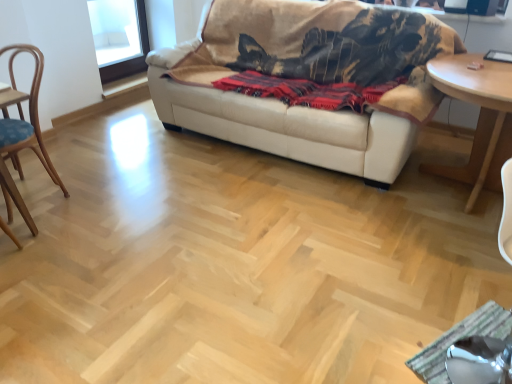
Question: Does wooden chair at left have a lesser height compared to red woven blanket at center?

Choices:
 (A) no
 (B) yes

Answer: (A)

Question: Can you confirm if wooden chair at left is taller than red woven blanket at center?

Choices:
 (A) yes
 (B) no

Answer: (A)

Question: Is red woven blanket at center inside wooden chair at left?

Choices:
 (A) yes
 (B) no

Answer: (B)

Question: Considering the relative sizes of wooden chair at left and red woven blanket at center in the image provided, is wooden chair at left wider than red woven blanket at center?

Choices:
 (A) yes
 (B) no

Answer: (A)

Question: Can you see wooden chair at left touching red woven blanket at center?

Choices:
 (A) no
 (B) yes

Answer: (A)

Question: From the image's perspective, is wooden chair at left on red woven blanket at center?

Choices:
 (A) no
 (B) yes

Answer: (A)

Question: Is beige leather couch at upper center far from metallic silver swivel chair at lower right?

Choices:
 (A) yes
 (B) no

Answer: (A)

Question: Is beige leather couch at upper center looking in the opposite direction of metallic silver swivel chair at lower right?

Choices:
 (A) yes
 (B) no

Answer: (B)

Question: From the image's perspective, is beige leather couch at upper center below metallic silver swivel chair at lower right?

Choices:
 (A) no
 (B) yes

Answer: (A)

Question: Is beige leather couch at upper center at the left side of metallic silver swivel chair at lower right?

Choices:
 (A) no
 (B) yes

Answer: (B)

Question: Can you confirm if beige leather couch at upper center is bigger than metallic silver swivel chair at lower right?

Choices:
 (A) no
 (B) yes

Answer: (B)

Question: Is beige leather couch at upper center shorter than metallic silver swivel chair at lower right?

Choices:
 (A) no
 (B) yes

Answer: (A)

Question: Is light brown wooden table at right located outside beige leather couch at upper center?

Choices:
 (A) yes
 (B) no

Answer: (A)